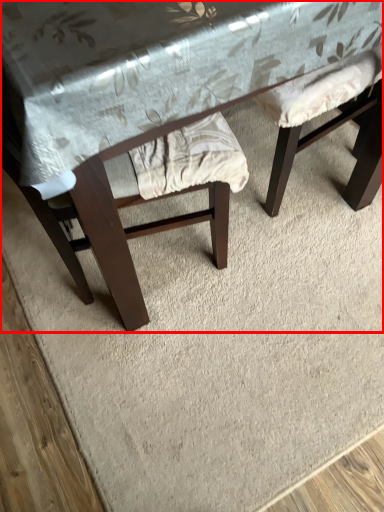
Question: From the image's perspective, where is table (annotated by the red box) located relative to swivel chair?

Choices:
 (A) below
 (B) above

Answer: (B)